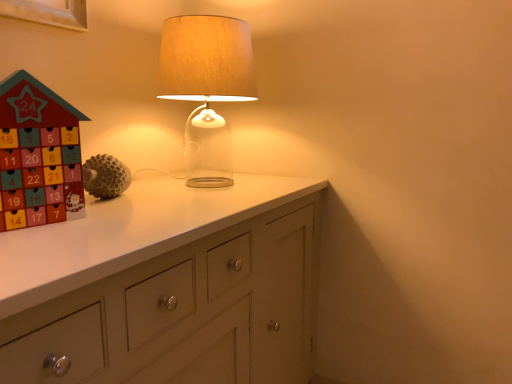
Question: Does translucent glass lamp at center come in front of wooden advent calendar at left?

Choices:
 (A) no
 (B) yes

Answer: (A)

Question: From a real-world perspective, is translucent glass lamp at center located higher than wooden advent calendar at left?

Choices:
 (A) yes
 (B) no

Answer: (A)

Question: Does translucent glass lamp at center have a lesser width compared to wooden advent calendar at left?

Choices:
 (A) yes
 (B) no

Answer: (B)

Question: Is translucent glass lamp at center to the left of wooden advent calendar at left from the viewer's perspective?

Choices:
 (A) no
 (B) yes

Answer: (A)

Question: Is translucent glass lamp at center far away from wooden advent calendar at left?

Choices:
 (A) yes
 (B) no

Answer: (B)

Question: Is translucent glass lamp at center positioned behind wooden advent calendar at left?

Choices:
 (A) yes
 (B) no

Answer: (A)

Question: Is wooden advent calendar at left facing towards translucent glass lamp at center?

Choices:
 (A) yes
 (B) no

Answer: (B)

Question: Is the surface of wooden advent calendar at left in direct contact with translucent glass lamp at center?

Choices:
 (A) yes
 (B) no

Answer: (B)

Question: Is wooden advent calendar at left positioned far away from translucent glass lamp at center?

Choices:
 (A) yes
 (B) no

Answer: (B)

Question: Can you confirm if wooden advent calendar at left is shorter than translucent glass lamp at center?

Choices:
 (A) yes
 (B) no

Answer: (A)

Question: Is wooden advent calendar at left to the left of translucent glass lamp at center from the viewer's perspective?

Choices:
 (A) no
 (B) yes

Answer: (B)

Question: Does wooden advent calendar at left have a smaller size compared to translucent glass lamp at center?

Choices:
 (A) no
 (B) yes

Answer: (B)

Question: Is translucent glass lamp at center bigger or smaller than wooden advent calendar at left?

Choices:
 (A) small
 (B) big

Answer: (B)